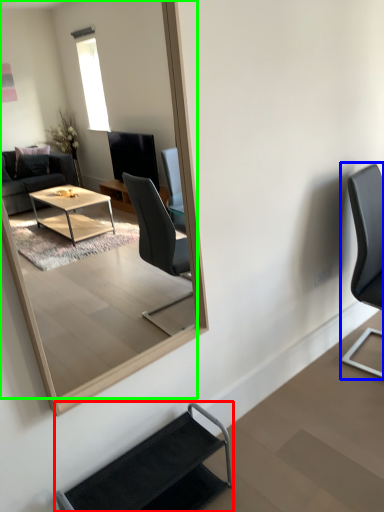
Question: Which is farther away from chair (highlighted by a red box)? chair (highlighted by a blue box) or mirror (highlighted by a green box)?

Choices:
 (A) chair
 (B) mirror

Answer: (B)